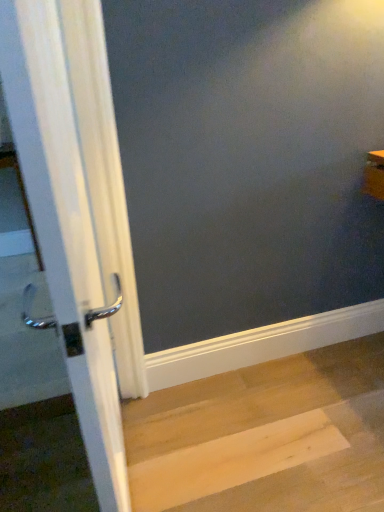
Question: Should I look upward or downward to see white glossy door handle at left?

Choices:
 (A) up
 (B) down

Answer: (B)